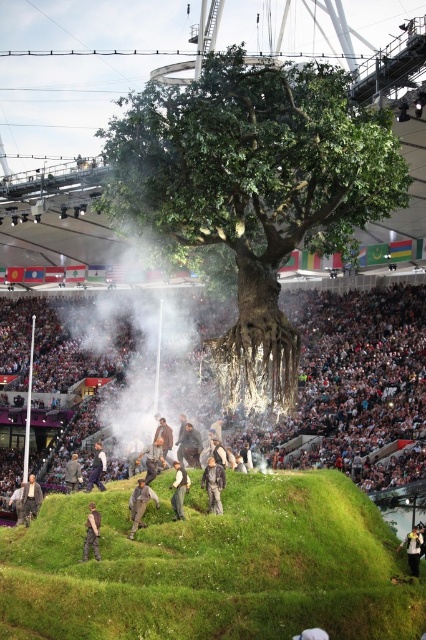
Question: Which object is positioned closest to the green grassy hillside at lower center?

Choices:
 (A) light brown leather jacket at lower left
 (B) dark gray woolen suit at lower left

Answer: (B)

Question: Can you confirm if leather jacket at center is positioned to the left of light brown leather jacket at lower left?

Choices:
 (A) no
 (B) yes

Answer: (A)

Question: Does green leafy tree at center come in front of camouflage pants at center?

Choices:
 (A) no
 (B) yes

Answer: (A)

Question: Does leather jacket at center appear under light brown leather jacket at center?

Choices:
 (A) no
 (B) yes

Answer: (A)

Question: Which object is the closest to the camouflage pants at center?

Choices:
 (A) leather jacket at center
 (B) green fabric pants at center
 (C) dark gray woolen suit at lower left
 (D) yellow fabric jacket at center

Answer: (B)

Question: Which point is farther from the camera taking this photo?

Choices:
 (A) (178, 496)
 (B) (302, 70)
 (C) (88, 556)

Answer: (B)